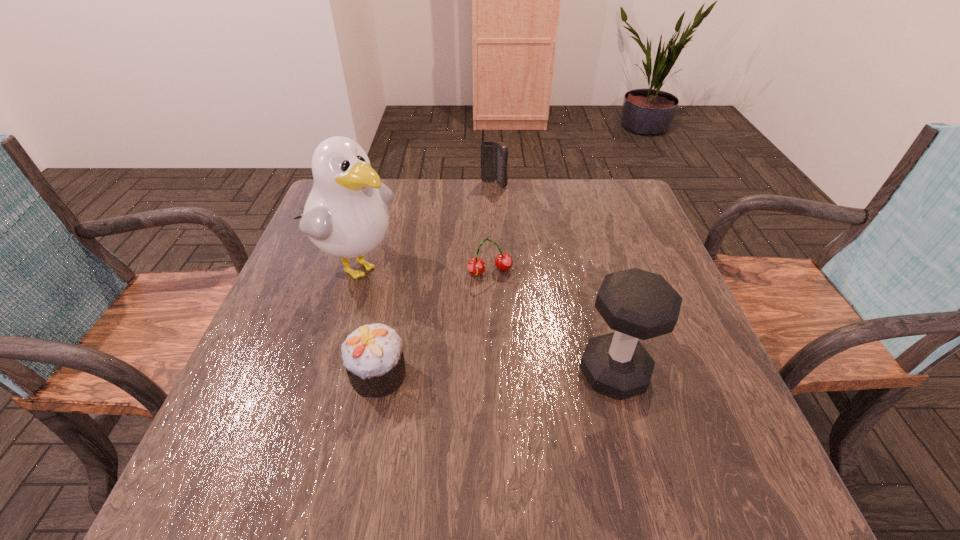
Locate an element on the screen. This screenshot has height=540, width=960. dumbbell present at the near edge is located at coordinates (637, 304).

Find the location of a particular element. This screenshot has width=960, height=540. object that is at the left edge is located at coordinates (346, 215).

Where is `object present at the right edge`? object present at the right edge is located at coordinates (637, 304).

The image size is (960, 540). What are the coordinates of `object that is at the near right corner` in the screenshot? It's located at (637, 304).

Where is `vacant space at the far edge of the desktop`? The image size is (960, 540). vacant space at the far edge of the desktop is located at coordinates (552, 220).

The height and width of the screenshot is (540, 960). In order to click on vacant region at the near edge of the desktop in this screenshot , I will do `click(371, 410)`.

This screenshot has height=540, width=960. Find the location of `vacant area at the left edge`. vacant area at the left edge is located at coordinates (311, 269).

This screenshot has width=960, height=540. Identify the location of vacant space at the near left corner of the desktop. (260, 414).

Where is `free space at the far right corner of the desktop`? Image resolution: width=960 pixels, height=540 pixels. free space at the far right corner of the desktop is located at coordinates (627, 181).

The image size is (960, 540). Identify the location of free space at the near right corner of the desktop. (722, 410).